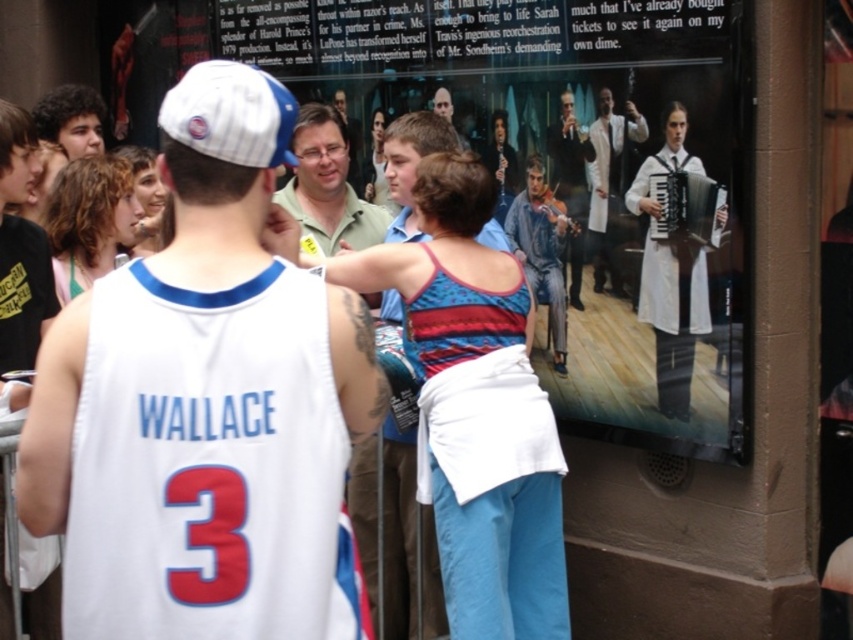
You are a photographer trying to capture a clear shot of the light brown wood violin at center and the smooth brown hair at center. Which object will appear larger in your photo?

The light brown wood violin at center will appear larger in the photo because it is closer to the viewer than the smooth brown hair at center.

You are standing in the street scene and want to find the matte white poster at center. According to the coordinates given, where should you look relative to the man in the white basketball jersey with

The matte white poster at center is located at coordinates point (550,166), which is to the right of the man in the white basketball jersey with